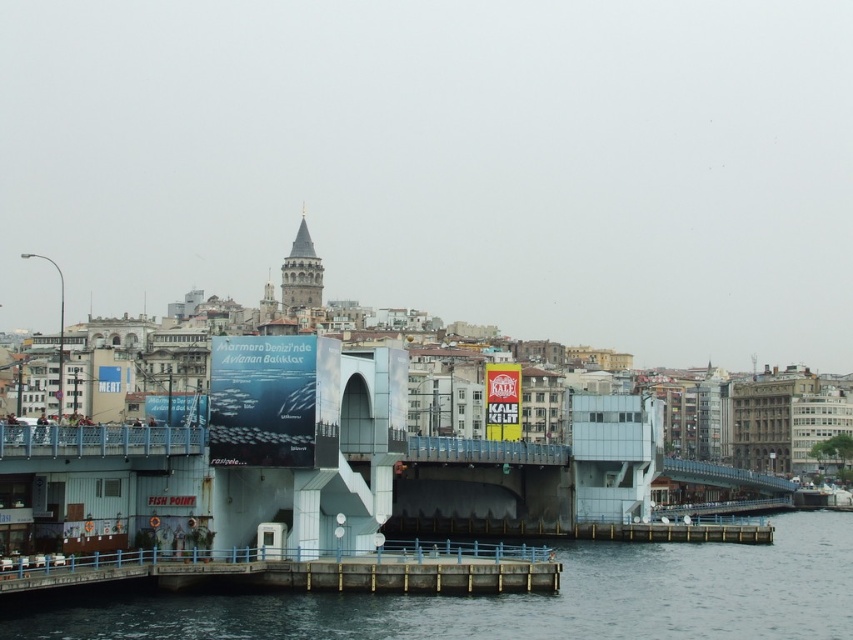
You are a boat captain trying to dock your vessel at the waterfront. You have two options for docking your boat, the smooth concrete pier at lower center and the smooth concrete dock at lower center. Which one has a wider structure to accommodate larger boats?

The smooth concrete pier at lower center has a larger width than the smooth concrete dock at lower center, so it can accommodate larger boats.

You are standing at the point with coordinates point (x=445, y=576) and want to walk to the point with coordinates point (x=610, y=595). Is the point you want to reach located behind or in front of your current position?

The point (x=610, y=595) is behind point (x=445, y=576), so the destination is behind your current position.